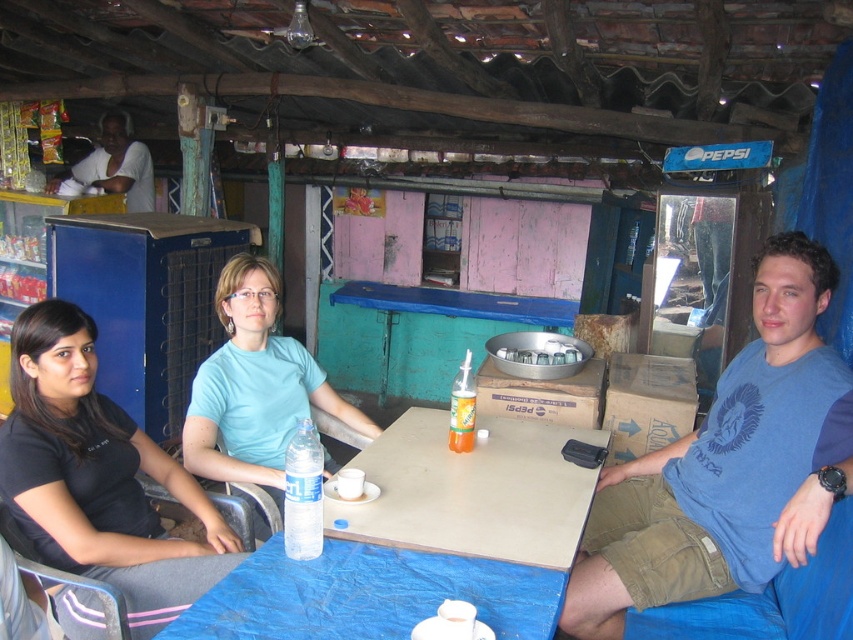
Is blue cotton shirt at right wider than white matte shirt at upper left?

Yes, blue cotton shirt at right is wider than white matte shirt at upper left.

Is point (723, 433) in front of point (126, 195)?

That is True.

Which is behind, point (724, 432) or point (48, 188)?

The point (48, 188) is more distant.

Locate an element on the screen. The height and width of the screenshot is (640, 853). blue cotton shirt at right is located at coordinates (729, 465).

Is blue cotton shirt at right wider than clear plastic bottle at table center?

Indeed, blue cotton shirt at right has a greater width compared to clear plastic bottle at table center.

Which is behind, point (711, 493) or point (463, 438)?

The point (463, 438) is more distant.

Is point (788, 509) less distant than point (462, 424)?

Yes, point (788, 509) is in front of point (462, 424).

This screenshot has width=853, height=640. I want to click on blue cotton shirt at right, so click(729, 465).

Which is above, matte blue shirt at center or clear plastic bottle at center?

matte blue shirt at center is above.

The image size is (853, 640). I want to click on matte blue shirt at center, so click(254, 385).

Locate an element on the screen. Image resolution: width=853 pixels, height=640 pixels. matte blue shirt at center is located at coordinates (254, 385).